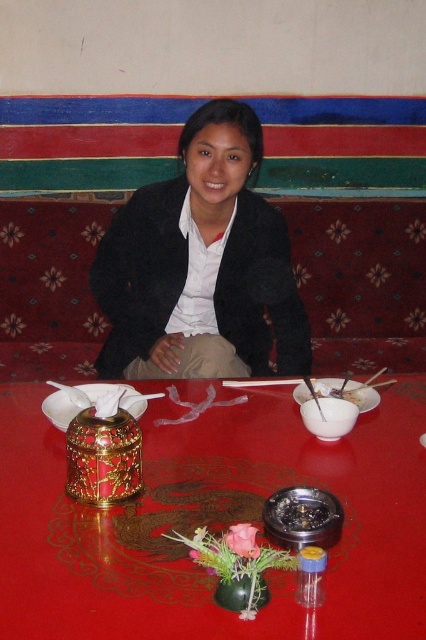
You are standing in front of the dining table and want to place a new item exactly where the black matte jacket at center is currently located. What coordinates should you use?

You should use the coordinates point (201, 266) to place the new item where the black matte jacket at center is located.